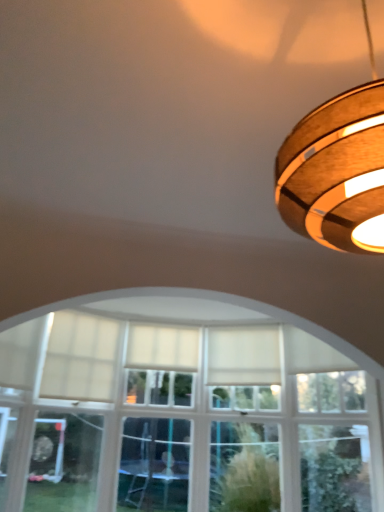
Question: From a real-world perspective, is wooden ring light at upper right positioned above or below white fabric curtain at center, which is counted as the first curtain, starting from the right?

Choices:
 (A) below
 (B) above

Answer: (B)

Question: Is wooden ring light at upper right spatially inside white fabric curtain at center, which is counted as the first curtain, starting from the right, or outside of it?

Choices:
 (A) outside
 (B) inside

Answer: (A)

Question: Based on their relative distances, which object is nearer to the white sheer curtain at center, the second curtain positioned from the right?

Choices:
 (A) white fabric curtain at center, which is counted as the first curtain, starting from the right
 (B) wooden ring light at upper right

Answer: (A)

Question: Estimate the real-world distances between objects in this image. Which object is farther from the white fabric curtain at center, which is counted as the first curtain, starting from the right?

Choices:
 (A) wooden ring light at upper right
 (B) white sheer curtain at center, the second curtain positioned from the right

Answer: (A)